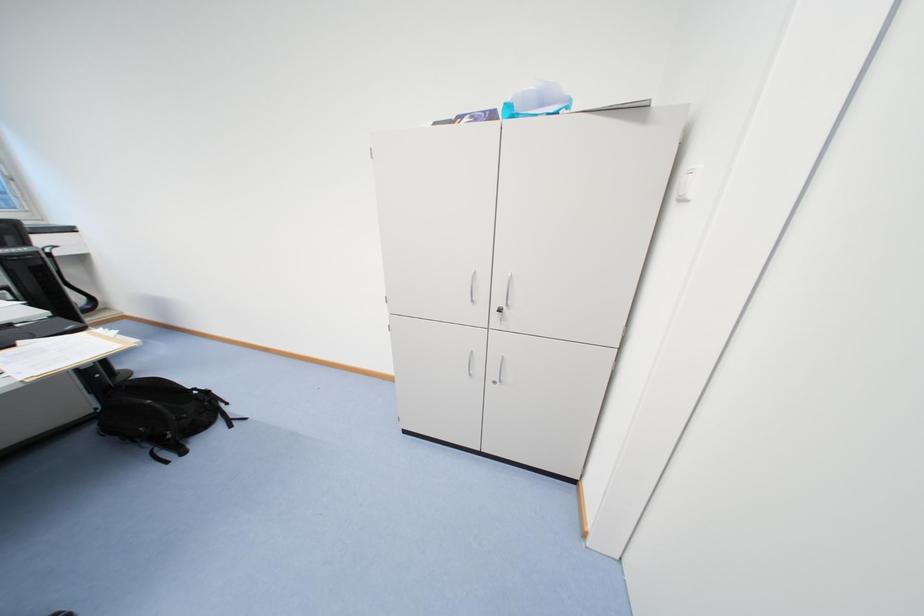
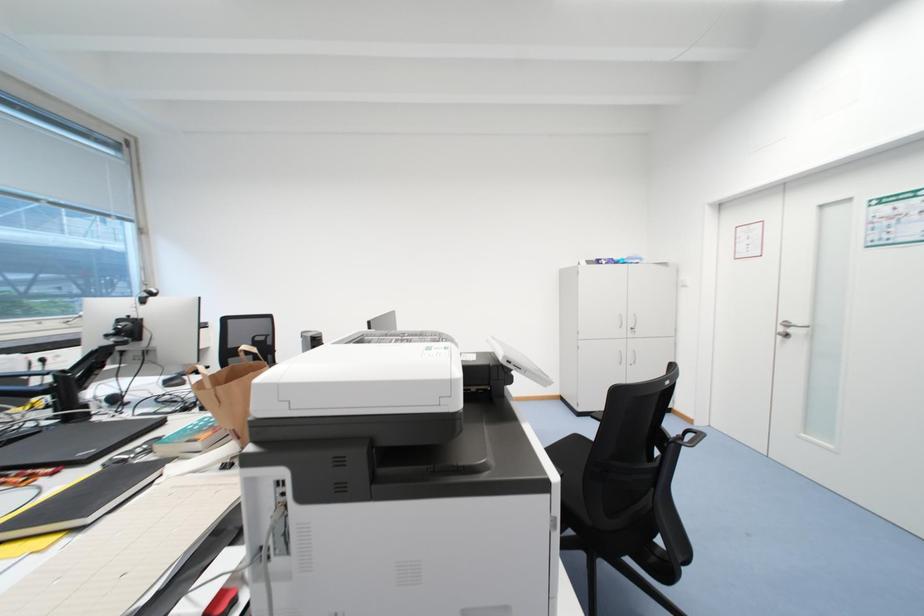
What movement of the cameraman would produce the second image?

The cameraman moved toward left, backward.